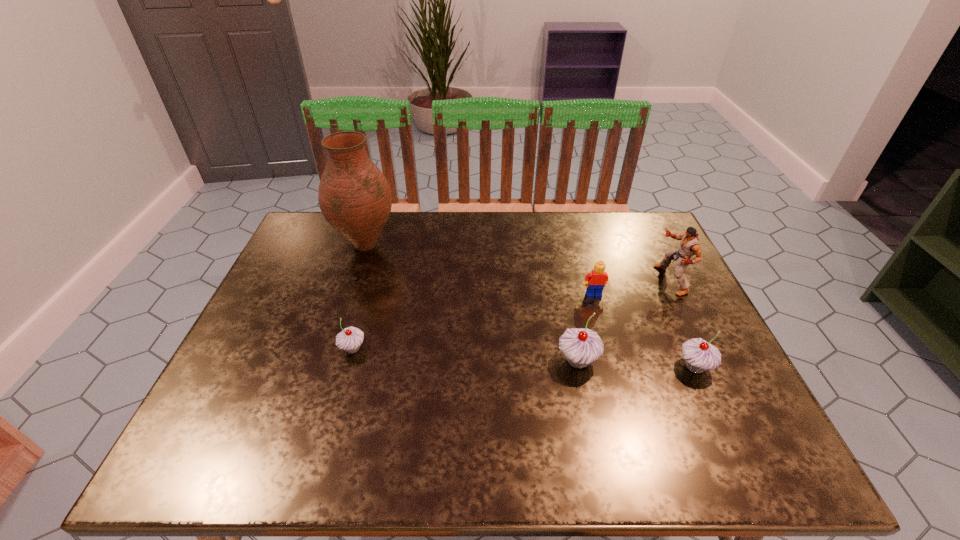
Locate an element on the screen. The image size is (960, 540). free region located 0.140m on the right of the vase is located at coordinates (444, 245).

Image resolution: width=960 pixels, height=540 pixels. In order to click on blank space located 0.190m on the face of the Lego in this screenshot , I will do `click(611, 355)`.

Where is `free space located on the front-facing side of the fifth shortest object`? The height and width of the screenshot is (540, 960). free space located on the front-facing side of the fifth shortest object is located at coordinates (516, 280).

Image resolution: width=960 pixels, height=540 pixels. Identify the location of free spot located on the front-facing side of the fifth shortest object. (538, 280).

The image size is (960, 540). I want to click on free spot located 0.190m on the front-facing side of the fifth shortest object, so click(588, 280).

Locate an element on the screen. Image resolution: width=960 pixels, height=540 pixels. object at the far edge is located at coordinates pos(355,198).

This screenshot has height=540, width=960. Find the location of `object at the left edge`. object at the left edge is located at coordinates (355, 198).

The image size is (960, 540). I want to click on cupcake at the right edge, so click(699, 355).

The image size is (960, 540). Find the location of `puncher positioned at the right edge`. puncher positioned at the right edge is located at coordinates (689, 245).

What are the coordinates of `object positioned at the far left corner` in the screenshot? It's located at (355, 198).